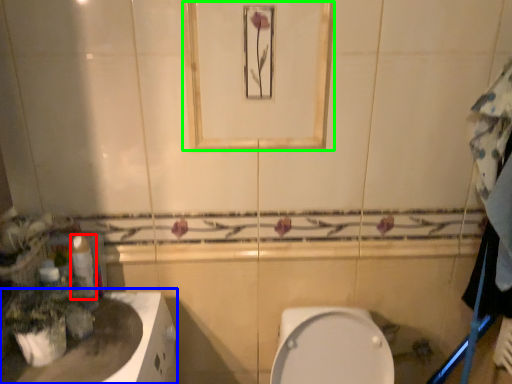
Question: Considering the real-world distances, which object is closest to toilet paper (highlighted by a red box)? counter top (highlighted by a blue box) or mirror (highlighted by a green box).

Choices:
 (A) counter top
 (B) mirror

Answer: (A)